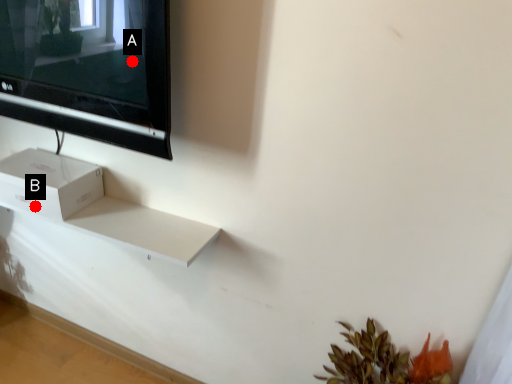
Question: Two points are circled on the image, labeled by A and B beside each circle. Which point is farther from the camera taking this photo?

Choices:
 (A) A is further
 (B) B is further

Answer: (B)